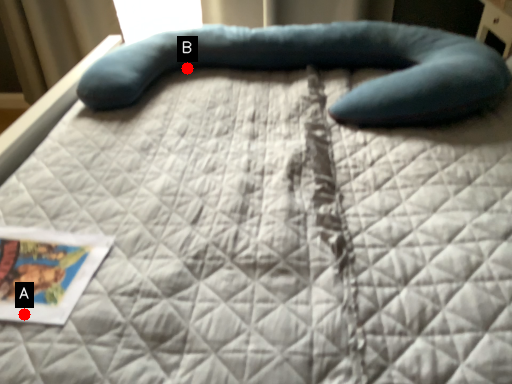
Question: Two points are circled on the image, labeled by A and B beside each circle. Which point is closer to the camera taking this photo?

Choices:
 (A) A is closer
 (B) B is closer

Answer: (A)